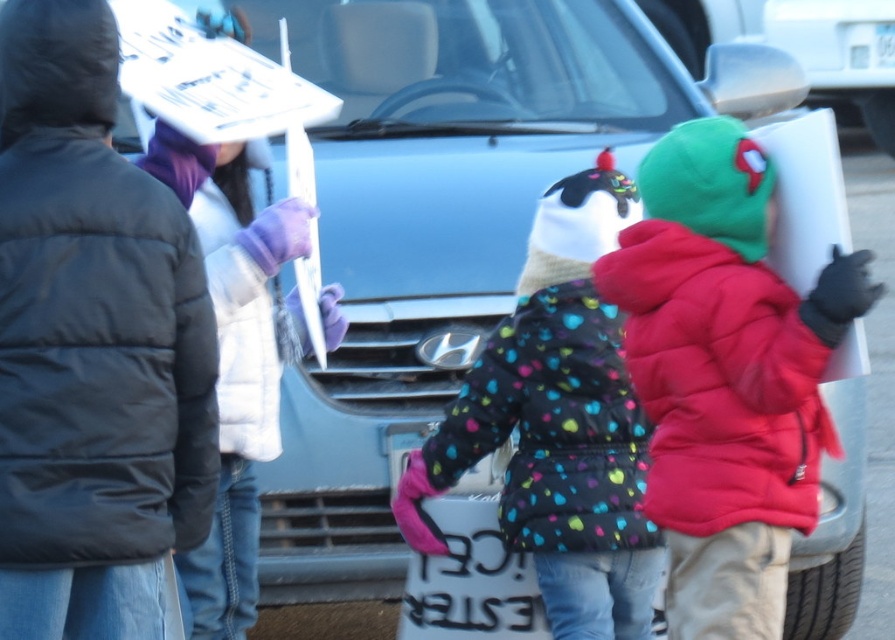
You are a photographer trying to capture a group shot of the polka dot puffer jacket at center and the white puffy jacket at left. Given that your camera has a minimum focus distance of 24 inches, will you be able to take a clear photo of both subjects without moving the camera?

The distance between the polka dot puffer jacket at center and the white puffy jacket at left is 26.16 inches, which is greater than the camera minimum focus distance of 24 inches. Therefore, you can take a clear photo of both subjects without moving the camera.

Looking at this image, you are a photographer trying to capture the protest scene. You notice two important points marked at coordinates point [0,262] and point [631,515]. If you want to focus on the point that is closer to the camera, which coordinate should you choose?

Point [0,262] is in front of point [631,515], so you should focus on point [0,262] as it is closer to the camera.

You are a photographer trying to capture a clear shot of the white puffy jacket at left and the metallic silver mirror at upper right. Which object would block the view of the other if positioned between the camera and the subject?

The white puffy jacket at left is in front of the metallic silver mirror at upper right, so the white puffy jacket at left would block the view of the metallic silver mirror at upper right if positioned between the camera and the subject.